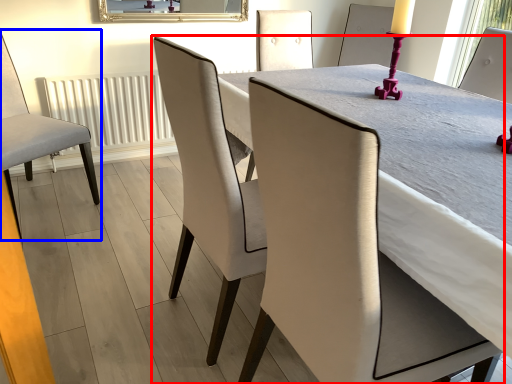
Question: Which object appears farthest to the camera in this image, chair (highlighted by a red box) or chair (highlighted by a blue box)?

Choices:
 (A) chair
 (B) chair

Answer: (B)